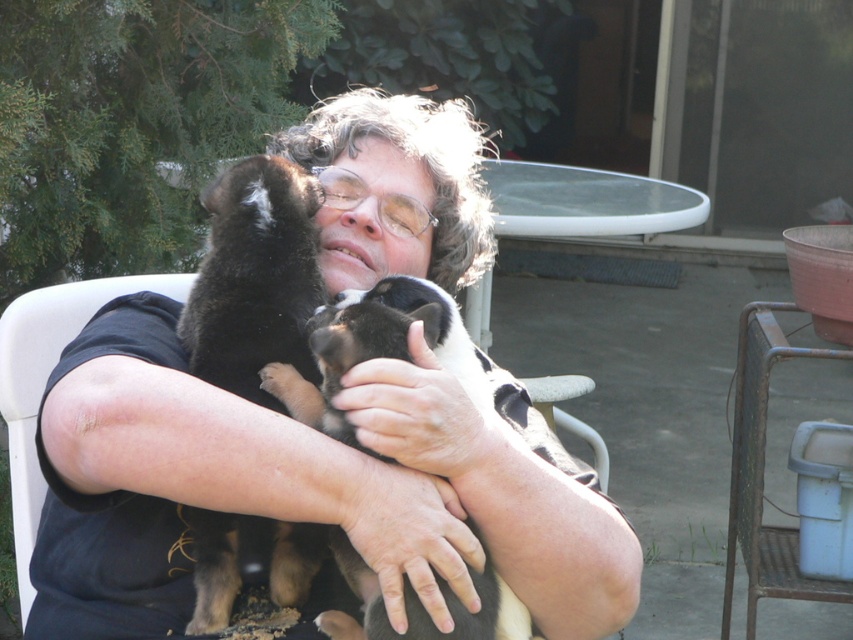
You are a photographer trying to capture the black fabric shirt at center in a closeup shot. Based on its position at point 0.766, 0.353, where should you aim your camera relative to the person sitting on the white plastic chair?

The black fabric shirt at center is located at point (300, 490), so you should aim your camera slightly to the right and lower down from the person sitting on the white plastic chair to capture the shirt in focus.

You are a photographer trying to capture a closeup of the black fur puppy at left without the black fabric shirt at center blocking the view. Can you adjust your position to do so?

The black fabric shirt at center is in front of the black fur puppy at left, so you need to move your camera position to the side or angle it so that the shirt is no longer blocking the puppy.